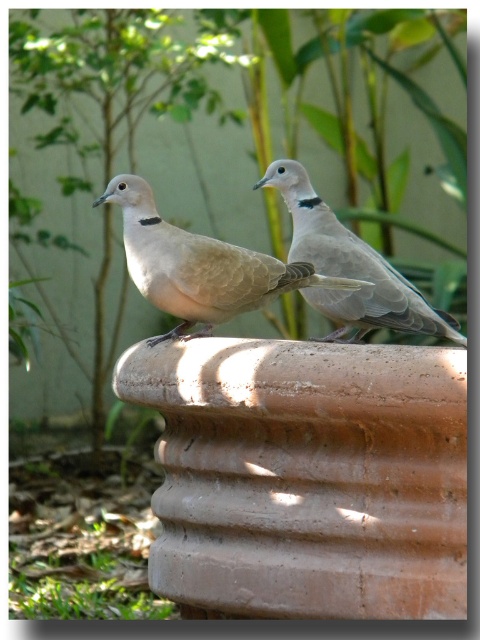
Is matte beige dove at center positioned behind light brown feathered dove at center?

No, matte beige dove at center is closer to the viewer.

How much distance is there between matte beige dove at center and light brown feathered dove at center?

matte beige dove at center is 7.65 inches from light brown feathered dove at center.

From the picture: Measure the distance between matte beige dove at center and camera.

matte beige dove at center and camera are 1.87 meters apart from each other.

You are a GUI agent. You are given a task and a screenshot of the screen. Output one action in this format:
    pyautogui.click(x=<x>, y=<y>)
    Task: Click on the matte beige dove at center
    
    Given the screenshot: What is the action you would take?
    pyautogui.click(x=200, y=266)